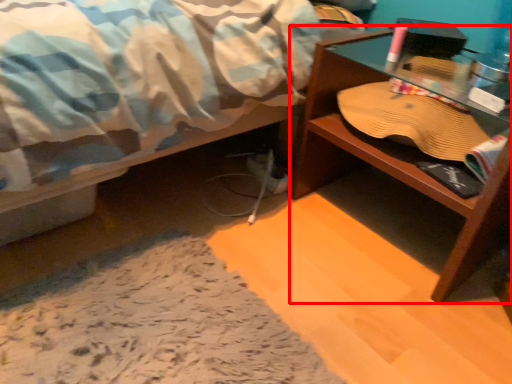
Question: Considering the relative positions of desk (annotated by the red box) and glass table in the image provided, where is desk (annotated by the red box) located with respect to the staircase?

Choices:
 (A) right
 (B) left

Answer: (A)